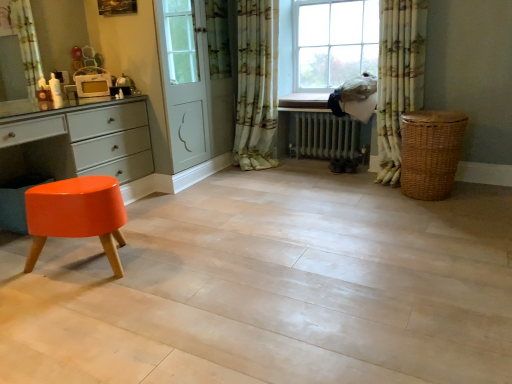
Question: Considering the positions of orange glossy stool at lower left and woven brown basket at right in the image, is orange glossy stool at lower left taller or shorter than woven brown basket at right?

Choices:
 (A) short
 (B) tall

Answer: (A)

Question: Is point (88, 203) closer or farther from the camera than point (418, 114)?

Choices:
 (A) farther
 (B) closer

Answer: (B)

Question: Which object is positioned farthest from the orange glossy stool at lower left?

Choices:
 (A) white metallic radiator at center
 (B) white glossy microwave at upper left
 (C) floral fabric curtain at right, acting as the second curtain starting from the left
 (D) glossy orange stool at lower left
 (E) woven brown basket at right

Answer: (A)

Question: Based on their relative distances, which object is nearer to the white metallic radiator at center?

Choices:
 (A) woven brown basket at right
 (B) white glossy microwave at upper left
 (C) floral fabric curtain at center, the 1th curtain positioned from the left
 (D) orange glossy stool at lower left
 (E) glossy orange stool at lower left

Answer: (C)